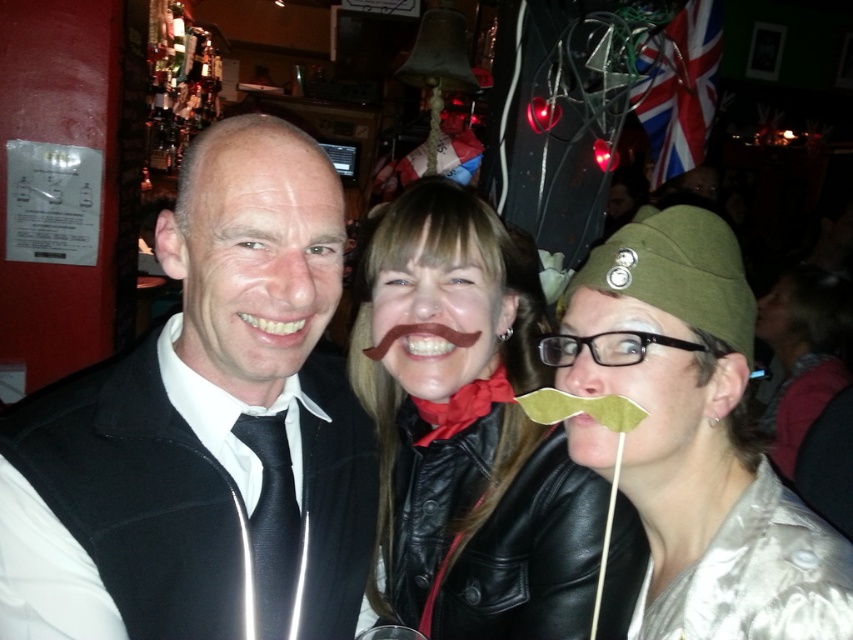
Is point (459, 332) in front of point (839, 611)?

No, (459, 332) is behind (839, 611).

Where is `brown leather jacket at center`? The image size is (853, 640). brown leather jacket at center is located at coordinates (468, 429).

Who is positioned more to the right, black matte suit at left or silky silver dress at lower right?

silky silver dress at lower right

Which of these two, black matte suit at left or silky silver dress at lower right, stands shorter?

Standing shorter between the two is silky silver dress at lower right.

You are a GUI agent. You are given a task and a screenshot of the screen. Output one action in this format:
    pyautogui.click(x=<x>, y=<y>)
    Task: Click on the black matte suit at left
    The width and height of the screenshot is (853, 640).
    Given the screenshot: What is the action you would take?
    pyautogui.click(x=206, y=429)

Is point (722, 410) closer to camera compared to point (788, 637)?

No.

The image size is (853, 640). Find the location of `silvery metallic hat at right`. silvery metallic hat at right is located at coordinates (697, 438).